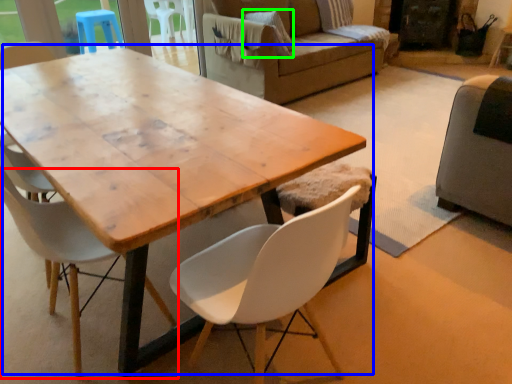
Question: Which is nearer to the chair (highlighted by a red box)? coffee table (highlighted by a blue box) or pillow (highlighted by a green box).

Choices:
 (A) coffee table
 (B) pillow

Answer: (A)